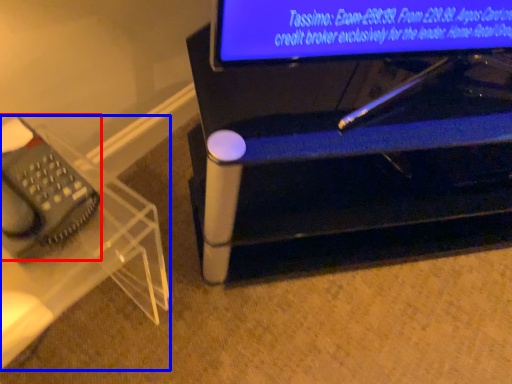
Question: Among these objects, which one is farthest to the camera, equipment (highlighted by a red box) or furniture (highlighted by a blue box)?

Choices:
 (A) equipment
 (B) furniture

Answer: (A)